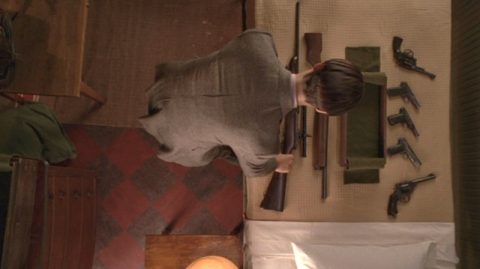
The height and width of the screenshot is (269, 480). I want to click on floor, so click(142, 63).